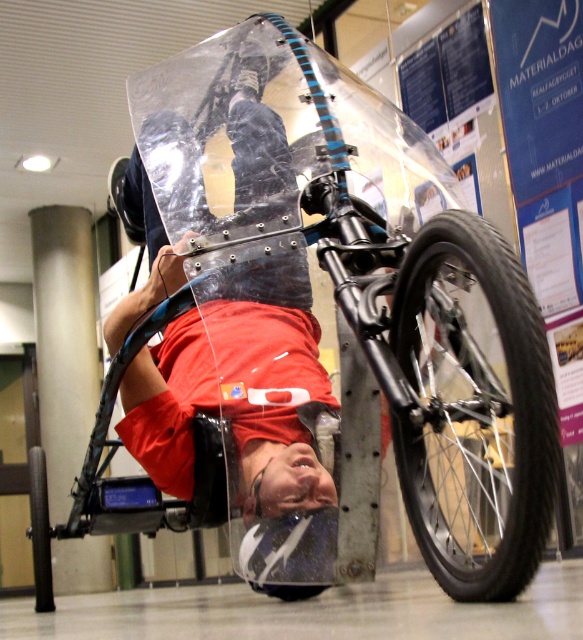
Question: Which object appears farthest from the camera in this image?

Choices:
 (A) transparent plastic bicycle at center
 (B) black rubber tire at lower right
 (C) black rubber tire at lower center

Answer: (C)

Question: Where is transparent plastic bicycle at center located in relation to black rubber tire at lower center in the image?

Choices:
 (A) above
 (B) below

Answer: (A)

Question: Does transparent plastic bicycle at center appear under black rubber tire at lower center?

Choices:
 (A) no
 (B) yes

Answer: (A)

Question: Where is transparent plastic bicycle at center located in relation to black rubber tire at lower center in the image?

Choices:
 (A) right
 (B) left

Answer: (A)

Question: Which point is farther to the camera?

Choices:
 (A) (349, 547)
 (B) (447, 486)
 (C) (52, 605)

Answer: (C)

Question: Which point is closer to the camera taking this photo?

Choices:
 (A) (234, 480)
 (B) (43, 500)
 (C) (469, 580)

Answer: (C)